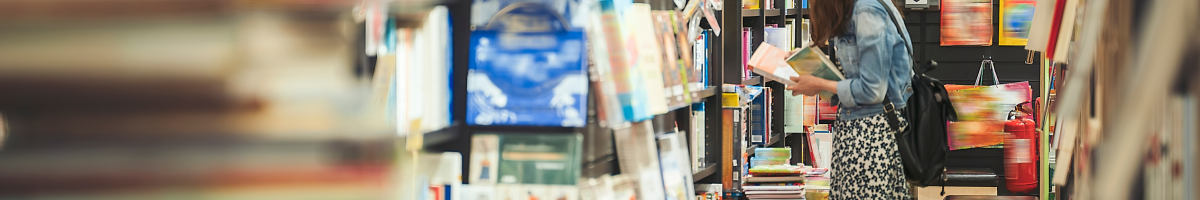
The height and width of the screenshot is (200, 1200). I want to click on posters, so click(964, 23), click(1014, 20).